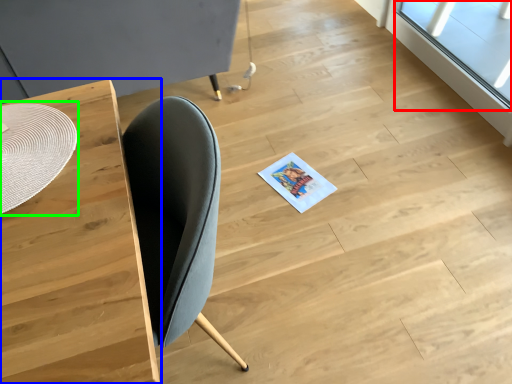
Question: Which is nearer to the window (highlighted by a red box)? table (highlighted by a blue box) or round table (highlighted by a green box).

Choices:
 (A) table
 (B) round table

Answer: (A)